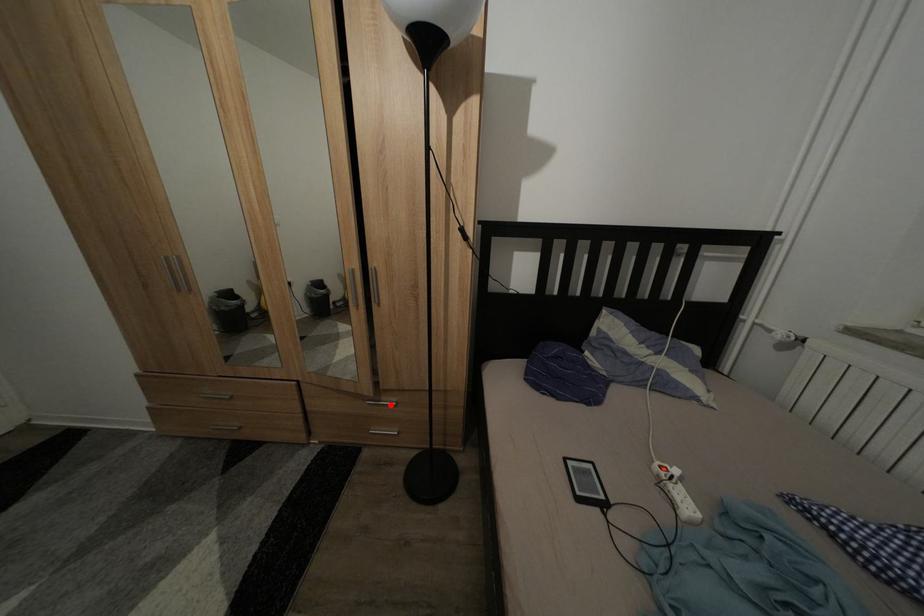
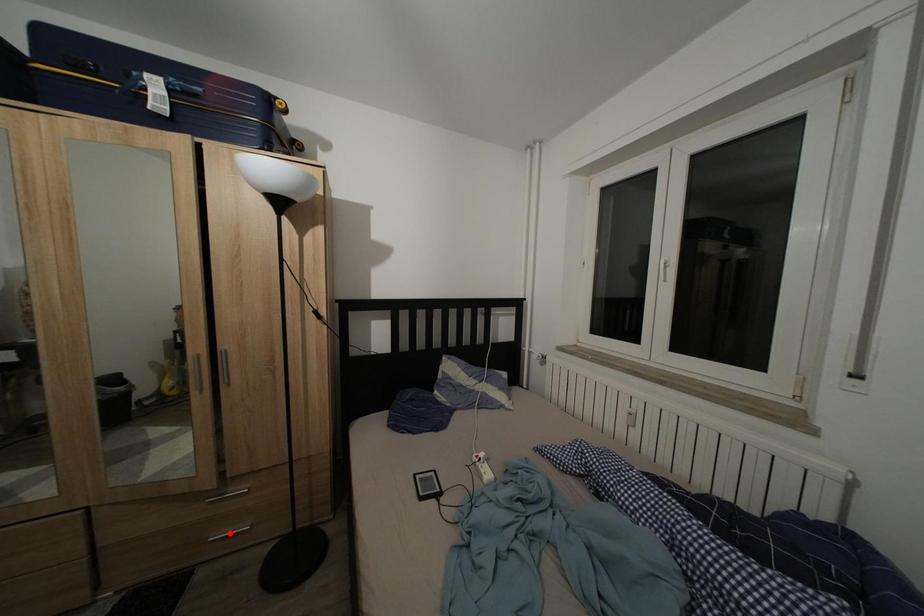
I am providing you with two images of the same scene from different viewpoints. A red point is marked on the first image and another point is marked on the second image. Do the highlighted points in image1 and image2 indicate the same real-world spot?

No